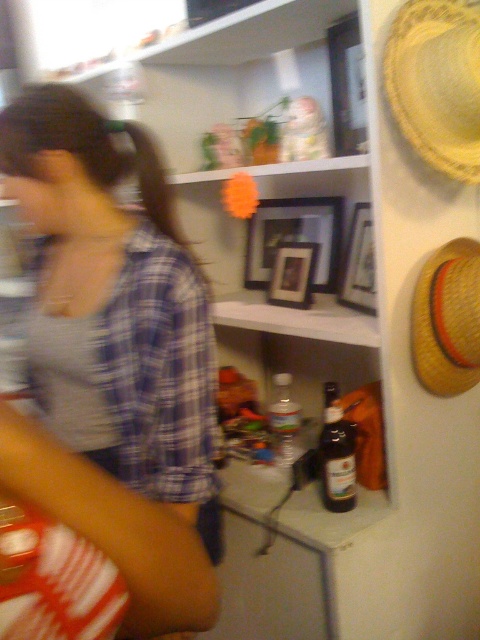
Who is higher up, blue plaid shirt at center or dark brown glass bottle at shelf center?

blue plaid shirt at center is higher up.

How much distance is there between blue plaid shirt at center and dark brown glass bottle at shelf center?

They are 18.34 inches apart.

Is point (132, 481) behind point (328, 449)?

No, it is in front of (328, 449).

Where is `blue plaid shirt at center`? This screenshot has height=640, width=480. blue plaid shirt at center is located at coordinates (115, 304).

Can you confirm if yellow straw hat at right is shorter than dark brown glass bottle at shelf center?

Incorrect, yellow straw hat at right's height does not fall short of dark brown glass bottle at shelf center's.

Does yellow straw hat at right have a lesser width compared to dark brown glass bottle at shelf center?

No, yellow straw hat at right is not thinner than dark brown glass bottle at shelf center.

Does point (458, 392) come in front of point (337, 401)?

No, (458, 392) is behind (337, 401).

Image resolution: width=480 pixels, height=640 pixels. Find the location of `yellow straw hat at right`. yellow straw hat at right is located at coordinates (447, 320).

Between yellow woven straw hat at upper right and yellow straw hat at right, which one is positioned higher?

yellow woven straw hat at upper right is higher up.

Is yellow woven straw hat at upper right bigger than yellow straw hat at right?

Yes, yellow woven straw hat at upper right is bigger than yellow straw hat at right.

The height and width of the screenshot is (640, 480). Find the location of `yellow woven straw hat at upper right`. yellow woven straw hat at upper right is located at coordinates (436, 83).